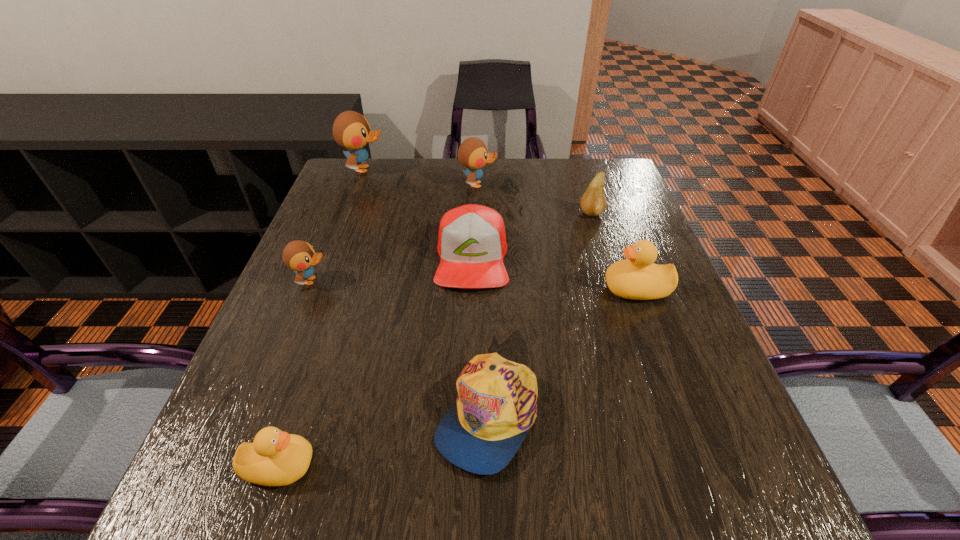
Locate an element on the screen. the biggest blue duck is located at coordinates (351, 130).

Find the location of a particular element. Image resolution: width=960 pixels, height=540 pixels. the tallest object is located at coordinates (351, 130).

The image size is (960, 540). I want to click on the second smallest blue duck, so click(x=472, y=153).

Locate an element on the screen. The height and width of the screenshot is (540, 960). the second duck from right to left is located at coordinates (472, 153).

Where is `the bigger yellow duck`? The width and height of the screenshot is (960, 540). the bigger yellow duck is located at coordinates (637, 277).

The image size is (960, 540). In order to click on the farther yellow duck in this screenshot , I will do `click(637, 277)`.

You are a GUI agent. You are given a task and a screenshot of the screen. Output one action in this format:
    pyautogui.click(x=<x>, y=<y>)
    Task: Click on the sixth nearest object
    The image size is (960, 540).
    Given the screenshot: What is the action you would take?
    pyautogui.click(x=593, y=202)

This screenshot has height=540, width=960. I want to click on baseball cap, so click(472, 243).

Where is `the smallest blue duck`? the smallest blue duck is located at coordinates (299, 256).

Identify the location of the left yellow duck. This screenshot has width=960, height=540. (275, 458).